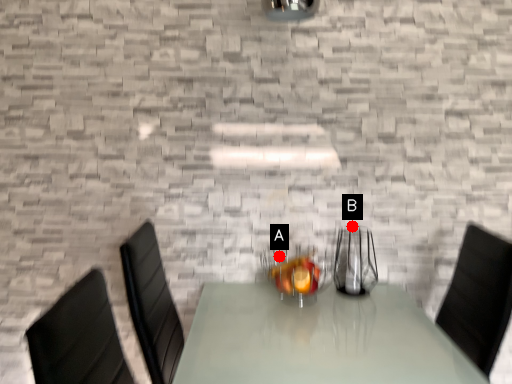
Question: Two points are circled on the image, labeled by A and B beside each circle. Which point is closer to the camera taking this photo?

Choices:
 (A) A is closer
 (B) B is closer

Answer: (B)